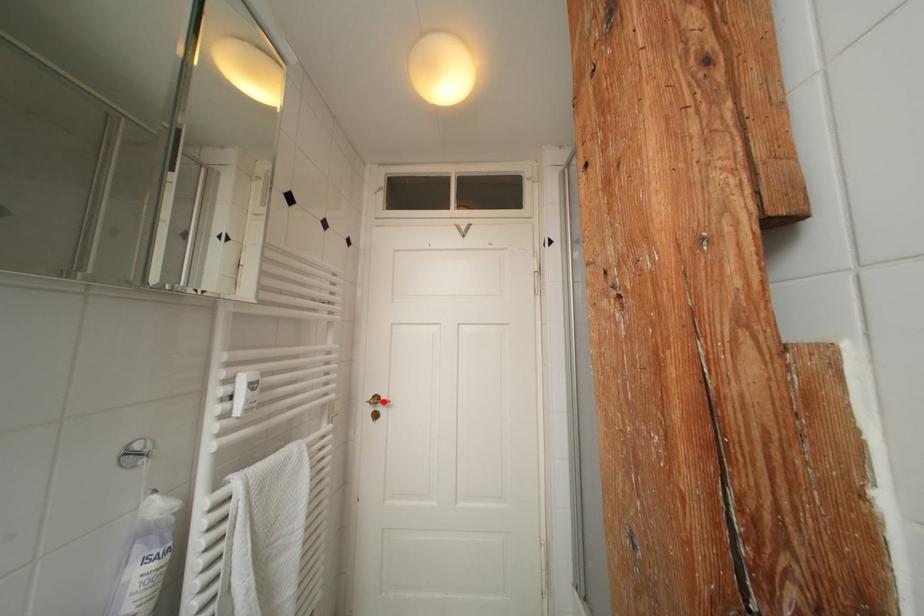
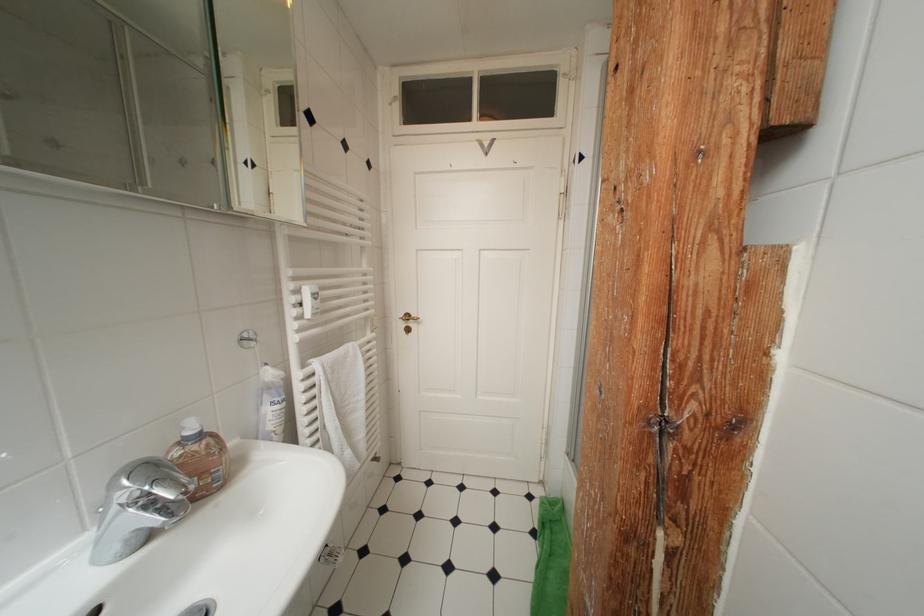
Where in the second image is the point corresponding to the highlighted location from the first image?

(415, 320)